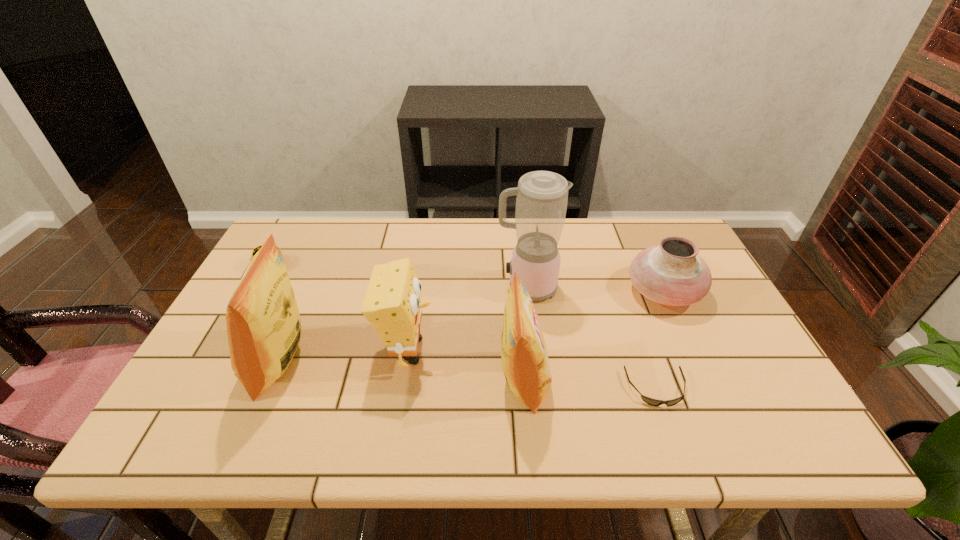
Where is `the sixth object from right to left`? The image size is (960, 540). the sixth object from right to left is located at coordinates (263, 323).

Where is `the second tallest object`? The image size is (960, 540). the second tallest object is located at coordinates (263, 323).

The image size is (960, 540). Identify the location of the shorter crisp (potato chip). (525, 363).

I want to click on the leftmost object, so click(x=256, y=249).

Where is `patty`? The image size is (960, 540). patty is located at coordinates coord(256,249).

In order to click on the fifth tallest object in this screenshot , I will do `click(671, 273)`.

At what (x,y) coordinates should I click in order to perform the action: click on food processor. Please return your answer as a coordinate pair (x, y). This screenshot has height=540, width=960. Looking at the image, I should click on pos(542,196).

Locate an element on the screen. Image resolution: width=960 pixels, height=540 pixels. sponge is located at coordinates (392, 304).

I want to click on the shortest object, so click(x=653, y=402).

The width and height of the screenshot is (960, 540). What are the coordinates of `free space located on the front-facing side of the taller crisp (potato chip)` in the screenshot? It's located at (223, 362).